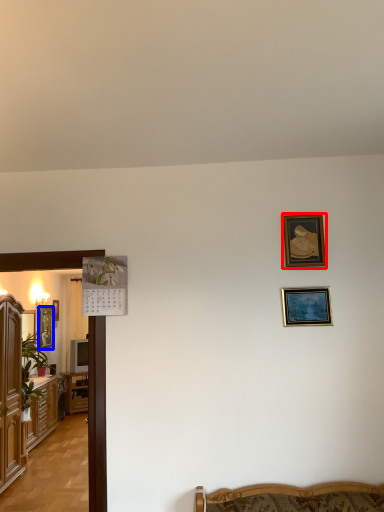
Question: Which object is closer to the camera taking this photo, picture frame (highlighted by a red box) or picture frame (highlighted by a blue box)?

Choices:
 (A) picture frame
 (B) picture frame

Answer: (A)